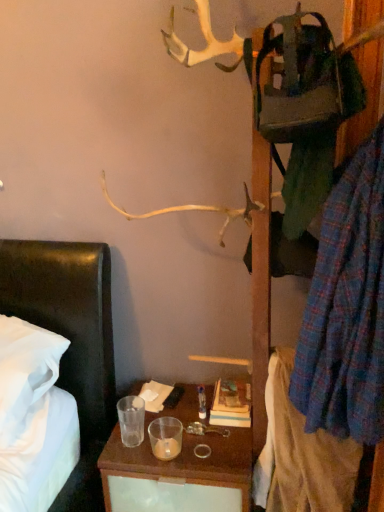
Question: Choose the correct answer: Is plaid fabric shirt at right, the 1th clothing when ordered from bottom to top, inside plaid fabric shirt at right, which is counted as the second clothing, starting from the bottom, or outside it?

Choices:
 (A) outside
 (B) inside

Answer: (A)

Question: Is plaid fabric shirt at right, the 1th clothing when ordered from bottom to top, bigger or smaller than plaid fabric shirt at right, which is the 1th clothing in top-to-bottom order?

Choices:
 (A) small
 (B) big

Answer: (A)

Question: In the image, is plaid fabric shirt at right, the 1th clothing when ordered from bottom to top, on the left side or the right side of plaid fabric shirt at right, which is counted as the second clothing, starting from the bottom?

Choices:
 (A) left
 (B) right

Answer: (A)

Question: Considering the positions of point (347, 177) and point (266, 472), is point (347, 177) closer or farther from the camera than point (266, 472)?

Choices:
 (A) closer
 (B) farther

Answer: (A)

Question: Relative to plaid fabric shirt at right, the 2th clothing positioned from the top, is plaid fabric shirt at right, which is the 1th clothing in top-to-bottom order, in front or behind?

Choices:
 (A) front
 (B) behind

Answer: (A)

Question: From the image's perspective, is plaid fabric shirt at right, which is the 1th clothing in top-to-bottom order, above or below plaid fabric shirt at right, the 2th clothing positioned from the top?

Choices:
 (A) below
 (B) above

Answer: (B)

Question: Considering the relative positions of plaid fabric shirt at right, which is counted as the second clothing, starting from the bottom, and plaid fabric shirt at right, the 2th clothing positioned from the top, in the image provided, is plaid fabric shirt at right, which is counted as the second clothing, starting from the bottom, to the left or to the right of plaid fabric shirt at right, the 2th clothing positioned from the top,?

Choices:
 (A) right
 (B) left

Answer: (A)